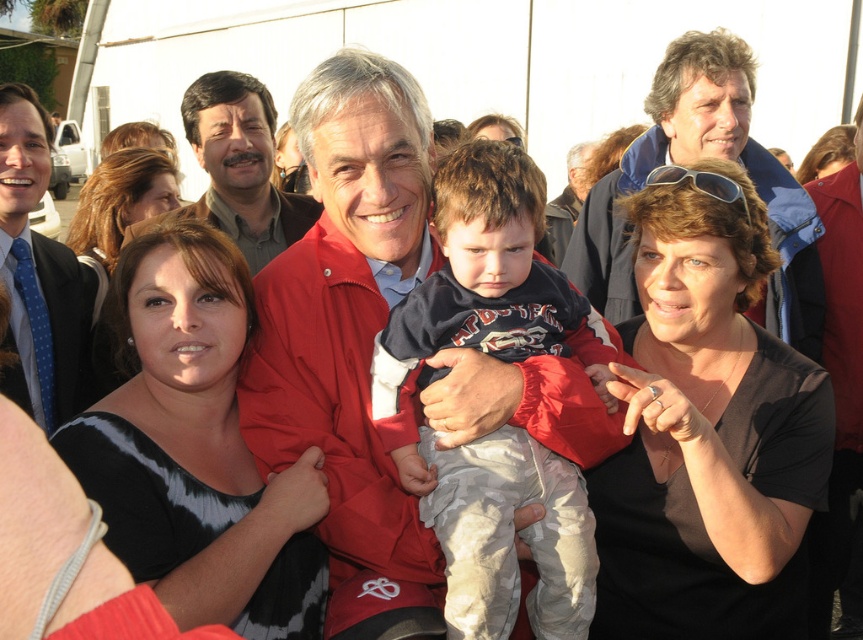
Question: Which of the following is the closest to the observer?

Choices:
 (A) camouflage fabric baby at center
 (B) smooth black dress at center

Answer: (A)

Question: Which point is farther to the camera?

Choices:
 (A) (74, 276)
 (B) (202, 157)

Answer: (B)

Question: Which point is closer to the camera?

Choices:
 (A) (3, 97)
 (B) (788, 612)

Answer: (B)

Question: Can you confirm if black satin dress at center is wider than blue dotted tie at left?

Choices:
 (A) yes
 (B) no

Answer: (A)

Question: Considering the relative positions of black matte shirt at center and black satin dress at center in the image provided, where is black matte shirt at center located with respect to black satin dress at center?

Choices:
 (A) below
 (B) above

Answer: (B)

Question: Is blue dotted tie at left above matte brown shirt at center?

Choices:
 (A) yes
 (B) no

Answer: (B)